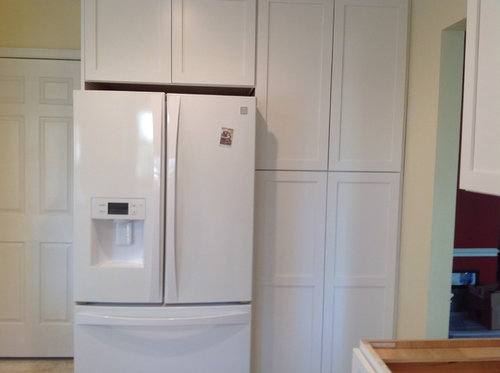
I want to click on freezer, so click(163, 347).